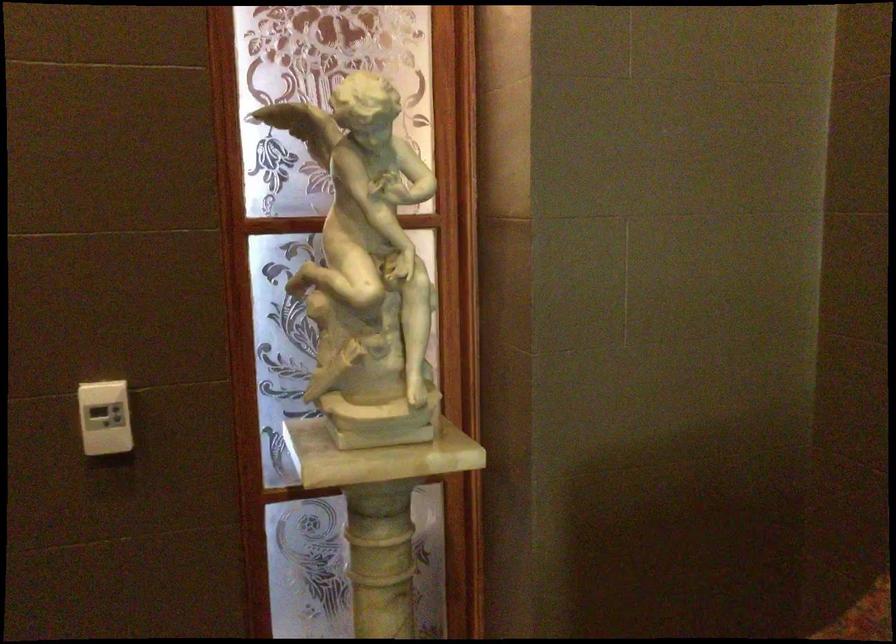
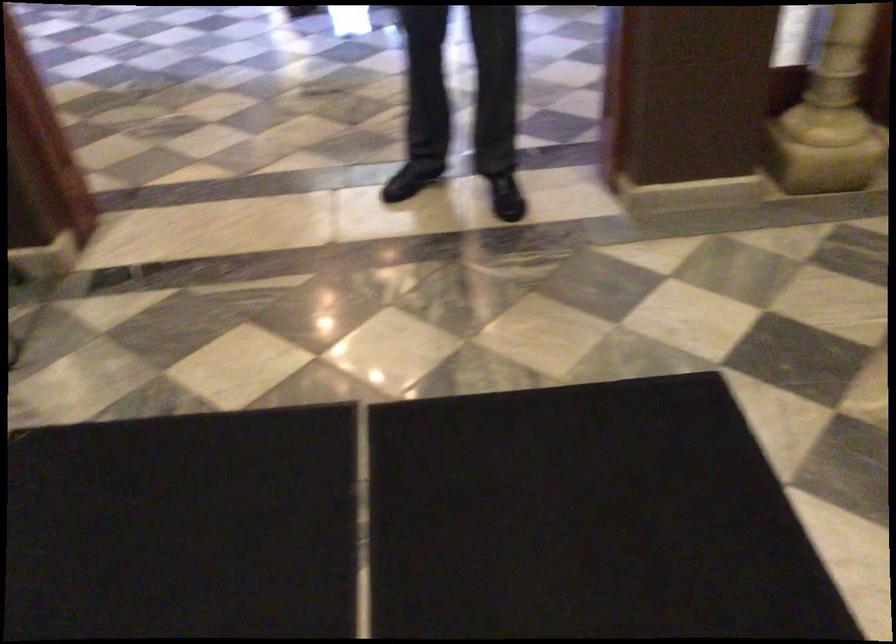
What movement of the cameraman would produce the second image?

The cameraman moved toward left, backward.